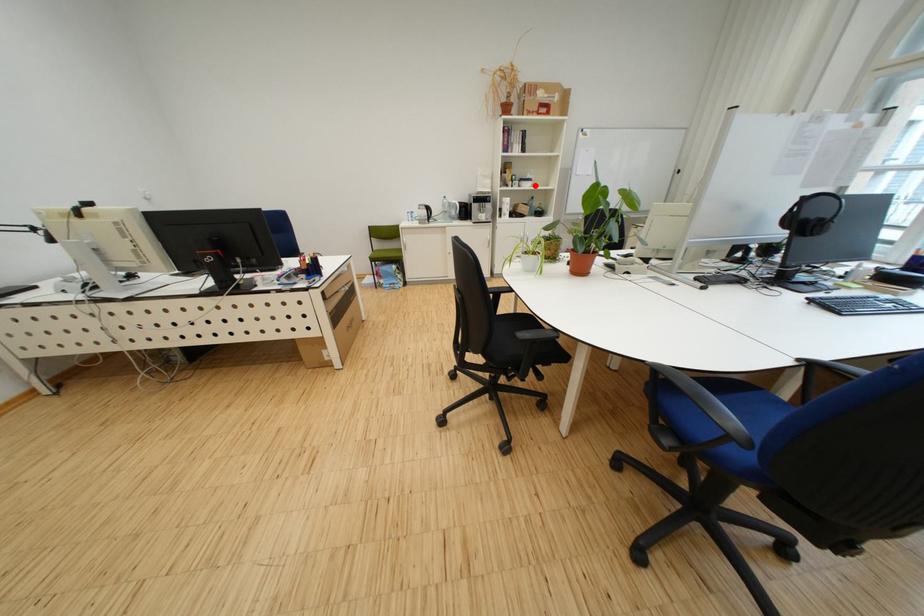
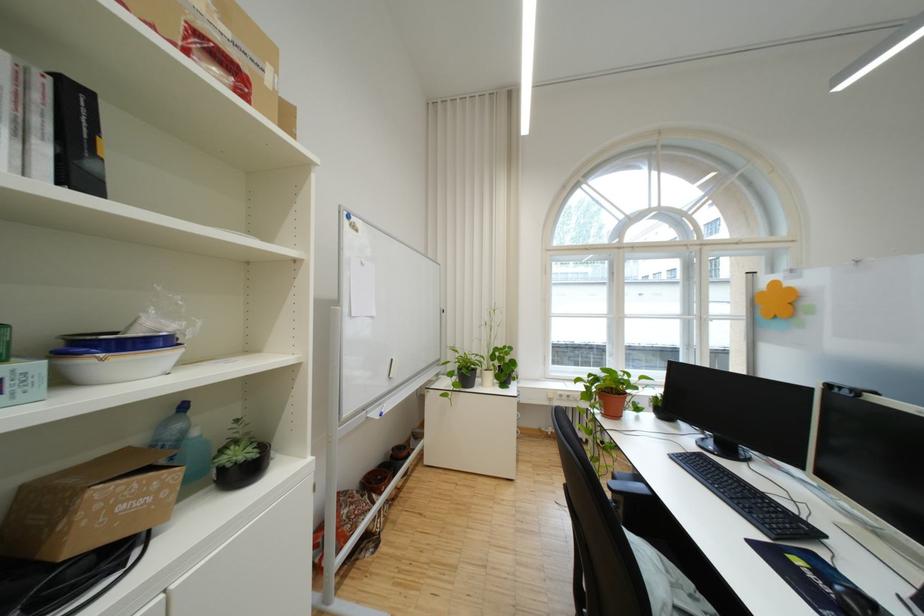
Locate, in the second image, the point that corresponds to the highlighted location in the first image.

(117, 365)